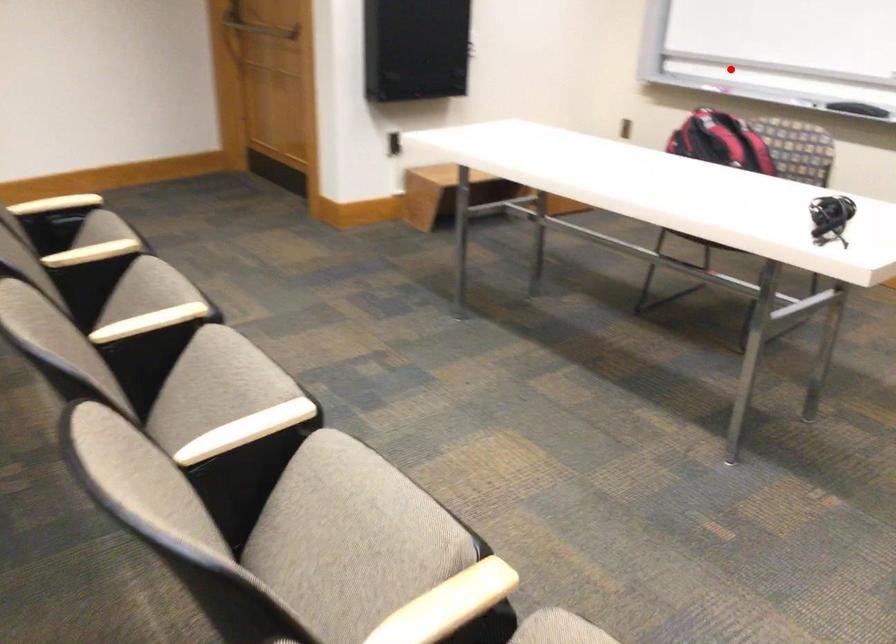
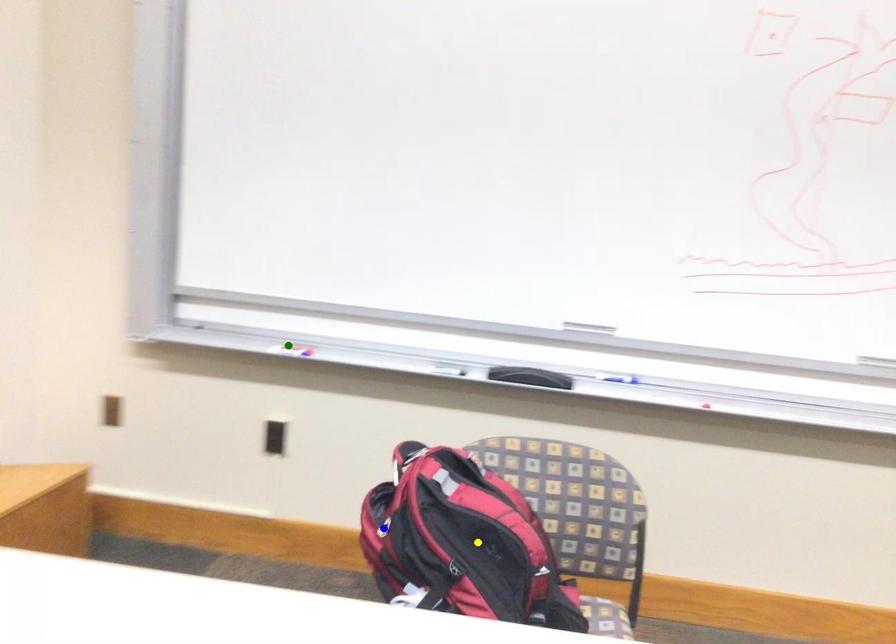
Question: I am providing you with two images of the same scene from different viewpoints. A red point is marked on the first image. You are given multiple points on the second image. In image 2, which mark is for the same physical point as the one in image 1?

Choices:
 (A) blue point
 (B) green point
 (C) yellow point

Answer: (B)